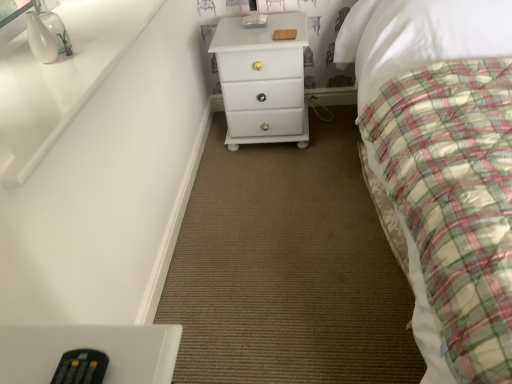
Question: Is white glossy chest of drawers at center at the left side of plaid fabric bed at right?

Choices:
 (A) yes
 (B) no

Answer: (A)

Question: Is white glossy chest of drawers at center not within plaid fabric bed at right?

Choices:
 (A) yes
 (B) no

Answer: (A)

Question: Is white glossy chest of drawers at center facing towards plaid fabric bed at right?

Choices:
 (A) no
 (B) yes

Answer: (A)

Question: From the image's perspective, is white glossy chest of drawers at center under plaid fabric bed at right?

Choices:
 (A) yes
 (B) no

Answer: (B)

Question: From the image's perspective, would you say white glossy chest of drawers at center is positioned over plaid fabric bed at right?

Choices:
 (A) yes
 (B) no

Answer: (A)

Question: In terms of size, does white glossy chest of drawers at center appear bigger or smaller than plaid fabric bed at right?

Choices:
 (A) small
 (B) big

Answer: (A)

Question: From the image's perspective, relative to plaid fabric bed at right, is white glossy chest of drawers at center above or below?

Choices:
 (A) below
 (B) above

Answer: (B)

Question: Do you think white glossy chest of drawers at center is within plaid fabric bed at right, or outside of it?

Choices:
 (A) outside
 (B) inside

Answer: (A)

Question: Considering the positions of point (278, 79) and point (345, 56), is point (278, 79) closer or farther from the camera than point (345, 56)?

Choices:
 (A) farther
 (B) closer

Answer: (B)

Question: Is white glossy chest of drawers at center to the left or to the right of black plastic remote at lower left in the image?

Choices:
 (A) right
 (B) left

Answer: (A)

Question: From the image's perspective, is white glossy chest of drawers at center above or below black plastic remote at lower left?

Choices:
 (A) below
 (B) above

Answer: (B)

Question: Is white glossy chest of drawers at center taller or shorter than black plastic remote at lower left?

Choices:
 (A) tall
 (B) short

Answer: (A)

Question: Is white glossy chest of drawers at center bigger or smaller than black plastic remote at lower left?

Choices:
 (A) small
 (B) big

Answer: (B)

Question: Would you say black plastic remote at lower left is to the left or to the right of plaid fabric bed at right in the picture?

Choices:
 (A) right
 (B) left

Answer: (B)

Question: Looking at their shapes, would you say black plastic remote at lower left is wider or thinner than plaid fabric bed at right?

Choices:
 (A) thin
 (B) wide

Answer: (A)